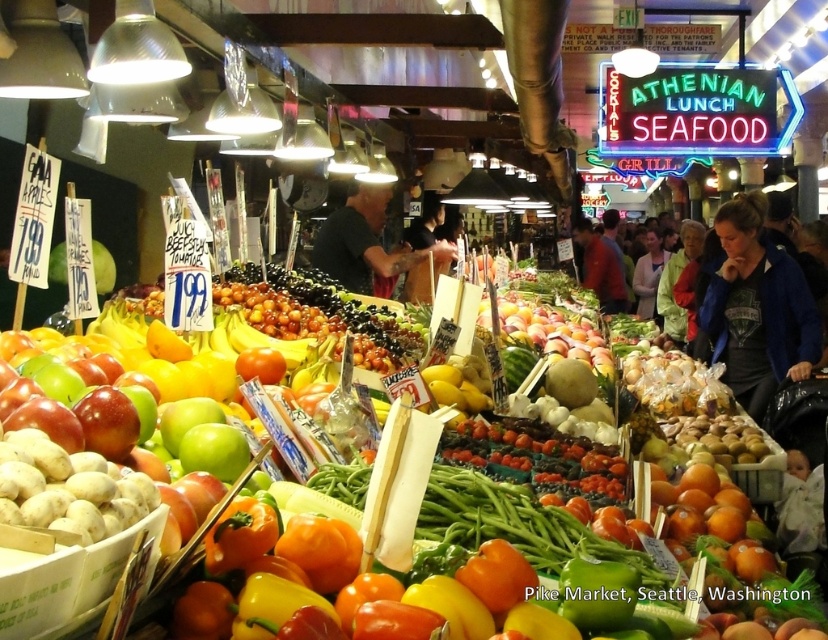
Question: Can you confirm if black shirt at center is thinner than red shirt at center?

Choices:
 (A) no
 (B) yes

Answer: (A)

Question: Which of the following is the farthest from the observer?

Choices:
 (A) (591, 252)
 (B) (388, 262)
 (C) (797, 292)

Answer: (A)

Question: Which point is farther to the camera?

Choices:
 (A) (410, 253)
 (B) (700, 317)
 (C) (598, 273)

Answer: (C)

Question: Can you confirm if blue fabric jacket at right is thinner than red shirt at center?

Choices:
 (A) no
 (B) yes

Answer: (B)

Question: Can you confirm if blue fabric jacket at right is thinner than red shirt at center?

Choices:
 (A) no
 (B) yes

Answer: (B)

Question: Which point appears farthest from the camera in this image?

Choices:
 (A) (383, 195)
 (B) (735, 259)

Answer: (A)